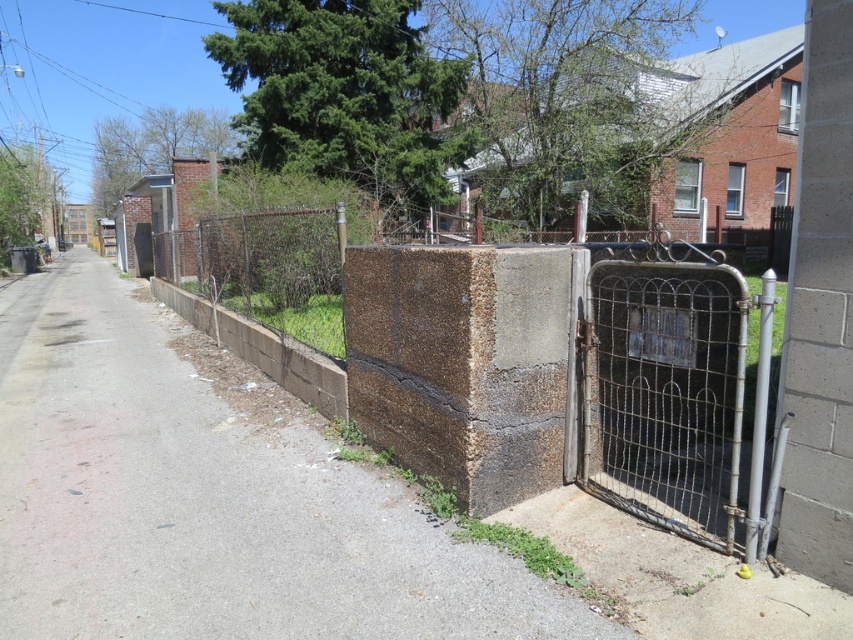
Question: Considering the real-world distances, which object is farthest from the brown concrete wall at center-right?

Choices:
 (A) brown concrete wall at center
 (B) rusty metal gate at center right

Answer: (B)

Question: Which of these objects is positioned closest to the rusty metal gate at center right?

Choices:
 (A) brown concrete wall at center
 (B) brown concrete wall at center-right

Answer: (A)

Question: Can you confirm if brown concrete wall at center-right is thinner than rusty metal gate at center right?

Choices:
 (A) no
 (B) yes

Answer: (A)

Question: Does brown concrete wall at center-right appear on the left side of rusty metal gate at center right?

Choices:
 (A) yes
 (B) no

Answer: (A)

Question: Among these points, which one is farthest from the camera?

Choices:
 (A) [x=436, y=355]
 (B) [x=647, y=339]

Answer: (A)

Question: Does brown concrete wall at center-right appear under rusty metal gate at center right?

Choices:
 (A) no
 (B) yes

Answer: (B)